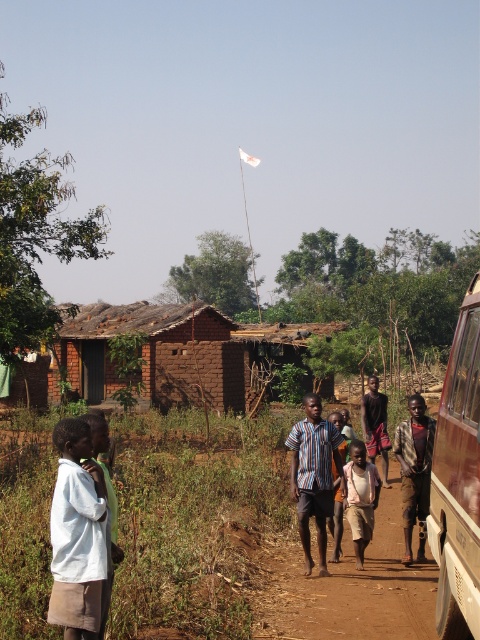
You are a teacher planning to pick up students from their village. The rustic wood school bus at right is parked at a specific location. Based on the scene description, where would you expect the school bus to be positioned relative to the children and the houses?

The rustic wood school bus at right is located at point (457,481), which is near the lower right corner of the image. This position places the bus close to the dirt path where the children are walking, making it easily accessible for them to board. It is also positioned away from the cluster of traditional mudbrick houses in the background, likely to avoid obstructing the village structures and to provide a clear boarding area.

You are a parent waiting to pick up your child from school. You see the rustic wood school bus at right and the white cotton shirt at lower left in the image. How far apart are these two objects?

The distance between the rustic wood school bus at right and the white cotton shirt at lower left is 2.22 meters.

You are a photographer positioned at the center of the scene. You want to capture a photo that includes both the group of children walking along the dirt path and the rustic wood school bus at right. Based on their positions, will the school bus be positioned to the left or right side of the photo?

The rustic wood school bus at right is located at point 0.752 on the x axis and 0.954 on the y axis. Since the photographer is at the center, the school bus is positioned to the right side of the photo.